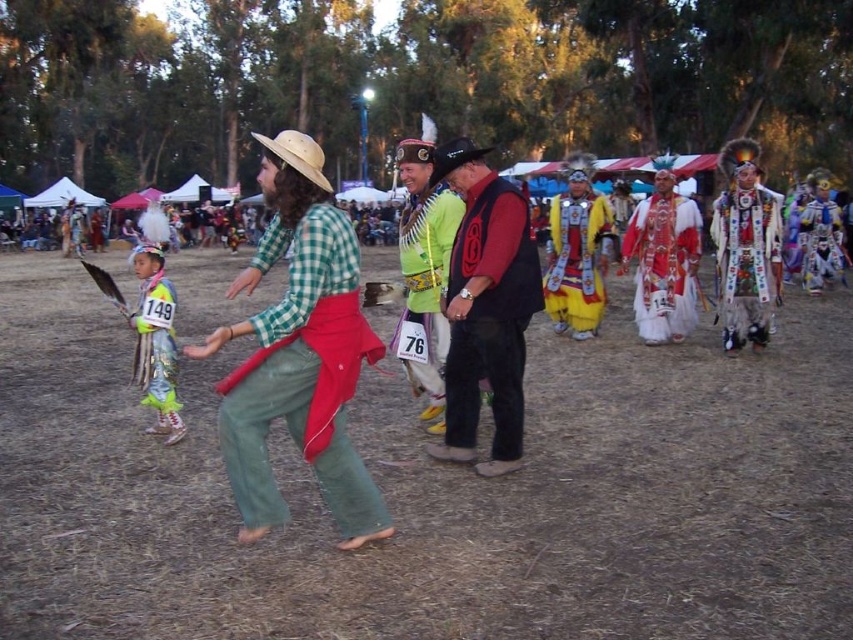
Question: Does embroidered velvet robe at right have a greater width compared to yellow satin regalia at center?

Choices:
 (A) yes
 (B) no

Answer: (B)

Question: Among these objects, which one is farthest from the camera?

Choices:
 (A) white and red fabric costume at right
 (B) embroidered velvet robe at right

Answer: (A)

Question: Is brown dry grass at center positioned in front of shiny metallic feathers at left?

Choices:
 (A) yes
 (B) no

Answer: (A)

Question: Which object is positioned farthest from the embroidered velvet robe at right?

Choices:
 (A) white and red fabric costume at right
 (B) yellow satin regalia at center

Answer: (B)

Question: Which object is positioned farthest from the velvet maroon vest at center?

Choices:
 (A) white feather headdress at right
 (B) brown dry grass at center
 (C) white and red fabric costume at right
 (D) shiny metallic feathers at left

Answer: (A)

Question: Can you confirm if brown dry grass at center is bigger than multicolored fabric headdress at center?

Choices:
 (A) no
 (B) yes

Answer: (B)